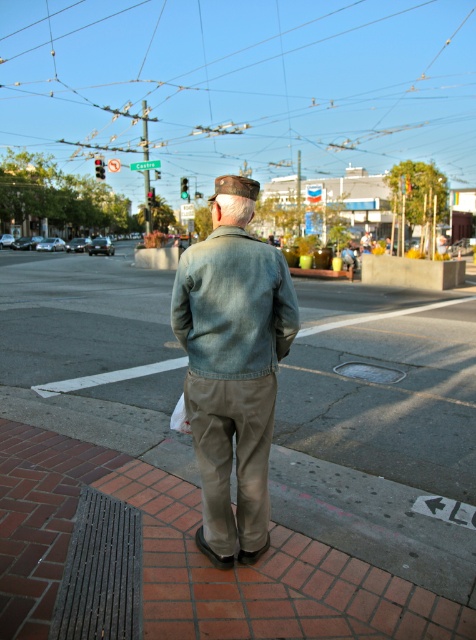
You are a delivery drone operator. Your drone is at the point marked at point (204, 454). You need to fly it to the elderly man standing on the brick sidewalk. How far will the drone have to travel?

The distance between the point (204, 454) and the elderly man is 2.65 meters, so the drone will have to travel 2.65 meters to reach him.